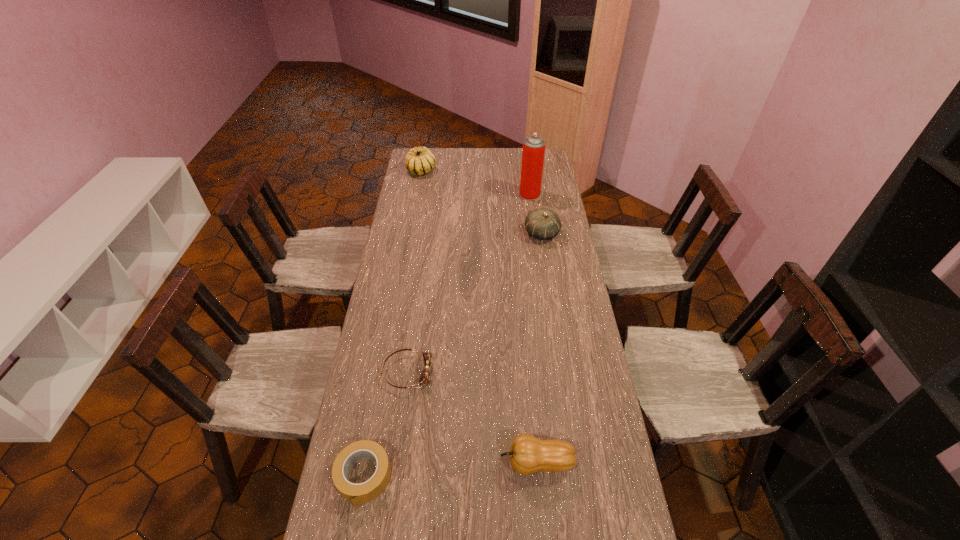
Where is `free spot between the goggles and the farthest gourd`? Image resolution: width=960 pixels, height=540 pixels. free spot between the goggles and the farthest gourd is located at coordinates (414, 272).

This screenshot has height=540, width=960. What are the coordinates of `free space between the nearest gourd and the farthest gourd` in the screenshot? It's located at (479, 316).

Where is `vacant point located between the leftmost gourd and the second farthest object`? vacant point located between the leftmost gourd and the second farthest object is located at coordinates (475, 183).

Locate an element on the screen. The image size is (960, 540). free point between the third farthest object and the nearest gourd is located at coordinates (540, 348).

The width and height of the screenshot is (960, 540). Find the location of `the fourth closest object to the nearest gourd`. the fourth closest object to the nearest gourd is located at coordinates (533, 152).

Identify which object is the fifth nearest to the goggles. Please provide its 2D coordinates. Your answer should be formatted as a tuple, i.e. [(x, y)], where the tuple contains the x and y coordinates of a point satisfying the conditions above.

[(419, 160)]

This screenshot has width=960, height=540. What are the coordinates of `gourd that is the nearest to the second farthest gourd` in the screenshot? It's located at (419, 160).

Where is `the second closest gourd to the second nearest gourd`? Image resolution: width=960 pixels, height=540 pixels. the second closest gourd to the second nearest gourd is located at coordinates (528, 454).

Identify the location of free point that satisfies the following two spatial constraints: 1. on the stem side of the nearest gourd; 2. at the edge of the duct tape. The height and width of the screenshot is (540, 960). (538, 477).

At what (x,y) coordinates should I click in order to perform the action: click on free space that satisfies the following two spatial constraints: 1. on the front side of the aerosol can; 2. through the lenses of the goggles. Please return your answer as a coordinate pair (x, y). This screenshot has width=960, height=540. Looking at the image, I should click on (554, 372).